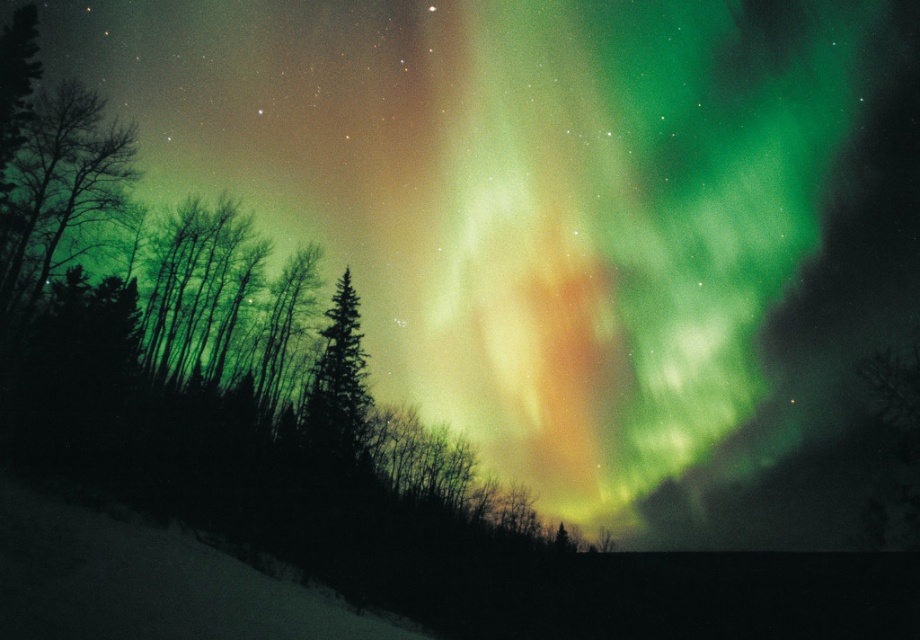
Can you confirm if green matte tree at left is smaller than green matte tree at center?

Yes, green matte tree at left is smaller than green matte tree at center.

Is green matte tree at left above green matte tree at center?

Indeed, green matte tree at left is positioned over green matte tree at center.

Where is `green matte tree at left`? The width and height of the screenshot is (920, 640). green matte tree at left is located at coordinates (63, 188).